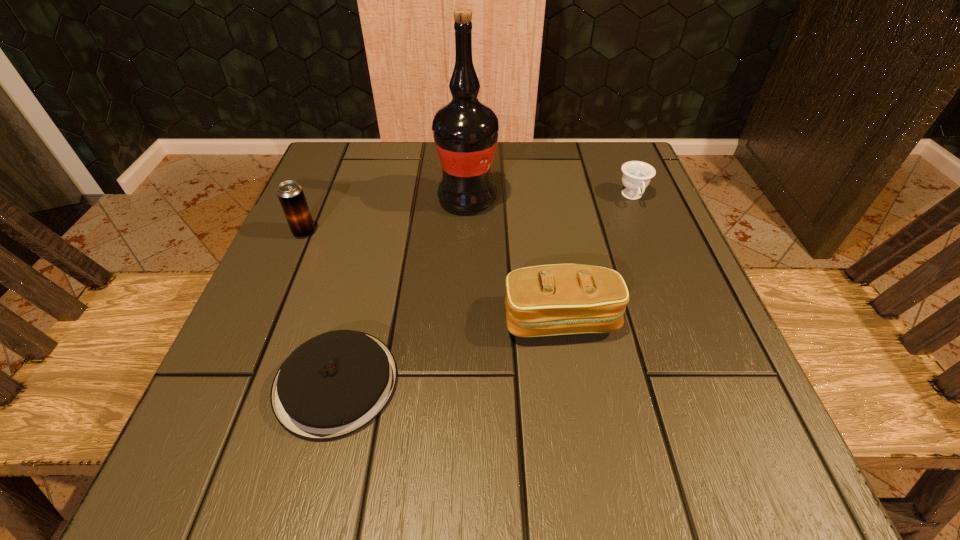
Where is `free space between the second tallest object and the teacup`? The width and height of the screenshot is (960, 540). free space between the second tallest object and the teacup is located at coordinates (468, 214).

Identify which object is the fourth closest to the fourth object from left to right. Please provide its 2D coordinates. Your answer should be formatted as a tuple, i.e. [(x, y)], where the tuple contains the x and y coordinates of a point satisfying the conditions above.

[(290, 194)]

Select which object is the third closest to the tallest object. Please provide its 2D coordinates. Your answer should be formatted as a tuple, i.e. [(x, y)], where the tuple contains the x and y coordinates of a point satisfying the conditions above.

[(636, 176)]

Locate an element on the screen. The width and height of the screenshot is (960, 540). vacant region that satisfies the following two spatial constraints: 1. on the front side of the beer can; 2. on the left side of the pancake is located at coordinates (240, 382).